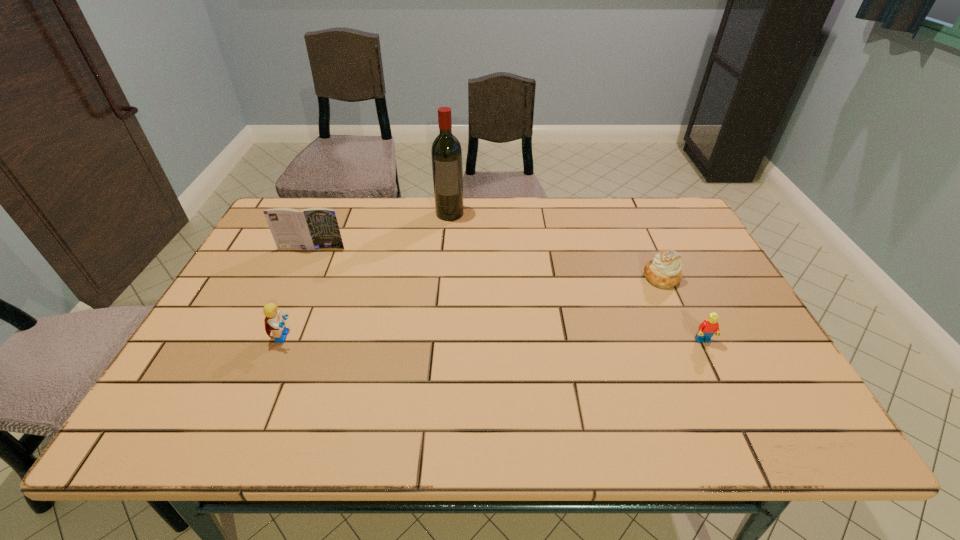
I want to click on the tallest object, so click(446, 152).

Identify the location of the third object from right to left. (446, 152).

Where is `book`? This screenshot has height=540, width=960. book is located at coordinates (313, 228).

Locate an element on the screen. the fourth shortest object is located at coordinates (313, 228).

Image resolution: width=960 pixels, height=540 pixels. Find the location of `the left Lego`. the left Lego is located at coordinates (274, 322).

The image size is (960, 540). In order to click on the third shortest object in this screenshot , I will do `click(274, 322)`.

This screenshot has height=540, width=960. What are the coordinates of `the third farthest object` in the screenshot? It's located at (664, 272).

Where is `the right Lego`? This screenshot has height=540, width=960. the right Lego is located at coordinates (709, 327).

This screenshot has width=960, height=540. Identify the location of vacant space located 0.140m on the label of the wine bottle. (446, 249).

You are a GUI agent. You are given a task and a screenshot of the screen. Output one action in this format:
    pyautogui.click(x=<x>, y=<y>)
    Task: Click on the vacant region located 0.230m on the front cover of the second tallest object
    
    Given the screenshot: What is the action you would take?
    pyautogui.click(x=285, y=306)